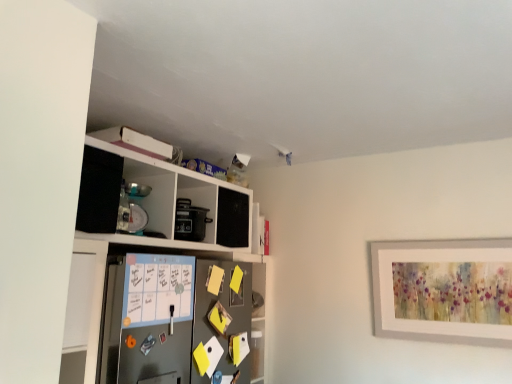
Where is `white matte cabinet at upper left`? The height and width of the screenshot is (384, 512). white matte cabinet at upper left is located at coordinates (162, 276).

The image size is (512, 384). What do you see at coordinates (162, 276) in the screenshot?
I see `white matte cabinet at upper left` at bounding box center [162, 276].

You are a GUI agent. You are given a task and a screenshot of the screen. Output one action in this format:
    pyautogui.click(x=<x>, y=<y>)
    Task: Click on the metallic gray refrigerator at center
    
    Given the screenshot: What is the action you would take?
    pyautogui.click(x=165, y=316)

This screenshot has height=384, width=512. What do you see at coordinates (165, 316) in the screenshot?
I see `metallic gray refrigerator at center` at bounding box center [165, 316].

Identify the location of white matte cabinet at upper left. (162, 276).

Considering the relative positions of white matte cabinet at upper left and metallic gray refrigerator at center in the image provided, is white matte cabinet at upper left to the left of metallic gray refrigerator at center from the viewer's perspective?

Yes.

Which object is further away from the camera, white matte cabinet at upper left or metallic gray refrigerator at center?

metallic gray refrigerator at center is further away from the camera.

Which is in front, point (120, 239) or point (231, 302)?

The point (120, 239) is closer to the camera.

From the image's perspective, is white matte cabinet at upper left positioned above or below metallic gray refrigerator at center?

From the image's perspective, white matte cabinet at upper left appears above metallic gray refrigerator at center.

From a real-world perspective, is white matte cabinet at upper left physically above metallic gray refrigerator at center?

Correct, in the physical world, white matte cabinet at upper left is higher than metallic gray refrigerator at center.

Which object is wider, white matte cabinet at upper left or metallic gray refrigerator at center?

white matte cabinet at upper left.

Considering the sizes of objects white matte cabinet at upper left and metallic gray refrigerator at center in the image provided, who is shorter, white matte cabinet at upper left or metallic gray refrigerator at center?

With less height is metallic gray refrigerator at center.

In the scene shown: Between white matte cabinet at upper left and metallic gray refrigerator at center, which one has smaller size?

metallic gray refrigerator at center.

Is white matte cabinet at upper left completely or partially outside of metallic gray refrigerator at center?

Yes, white matte cabinet at upper left is located beyond the bounds of metallic gray refrigerator at center.

Are white matte cabinet at upper left and metallic gray refrigerator at center far apart?

They are positioned close to each other.

Consider the image. Is white matte cabinet at upper left oriented towards metallic gray refrigerator at center?

Yes, white matte cabinet at upper left is aimed at metallic gray refrigerator at center.

How many degrees apart are the facing directions of white matte cabinet at upper left and metallic gray refrigerator at center?

The facing directions of white matte cabinet at upper left and metallic gray refrigerator at center are 3.23e-05 degrees apart.

This screenshot has width=512, height=384. In order to click on shelf lying on the left of metallic gray refrigerator at center in this screenshot , I will do `click(162, 276)`.

Considering the positions of objects metallic gray refrigerator at center and white matte cabinet at upper left in the image provided, who is more to the right, metallic gray refrigerator at center or white matte cabinet at upper left?

metallic gray refrigerator at center.

In the image, is metallic gray refrigerator at center positioned in front of or behind white matte cabinet at upper left?

metallic gray refrigerator at center is behind white matte cabinet at upper left.

Between point (174, 295) and point (250, 288), which one is positioned behind?

The point (250, 288) is farther.

From the image's perspective, is metallic gray refrigerator at center on top of white matte cabinet at upper left?

No, from the image's perspective, metallic gray refrigerator at center is not over white matte cabinet at upper left.

From a real-world perspective, between metallic gray refrigerator at center and white matte cabinet at upper left, who is vertically lower?

In real-world perspective, metallic gray refrigerator at center is lower.

Which of these two, metallic gray refrigerator at center or white matte cabinet at upper left, is thinner?

With smaller width is metallic gray refrigerator at center.

From their relative heights in the image, would you say metallic gray refrigerator at center is taller or shorter than white matte cabinet at upper left?

In the image, metallic gray refrigerator at center appears to be shorter than white matte cabinet at upper left.

Is metallic gray refrigerator at center smaller than white matte cabinet at upper left?

Indeed, metallic gray refrigerator at center has a smaller size compared to white matte cabinet at upper left.

Is metallic gray refrigerator at center completely or partially outside of white matte cabinet at upper left?

No, metallic gray refrigerator at center is not entirely external to white matte cabinet at upper left.

Is metallic gray refrigerator at center beside white matte cabinet at upper left?

metallic gray refrigerator at center is not next to white matte cabinet at upper left, and they're not touching.

Is metallic gray refrigerator at center positioned with its back to white matte cabinet at upper left?

Yes, metallic gray refrigerator at center is facing away from white matte cabinet at upper left.

How many degrees apart are the facing directions of metallic gray refrigerator at center and white matte cabinet at upper left?

They differ by 3.23e-05 degrees in their facing directions.

Where is `shelf above the metallic gray refrigerator at center (from a real-world perspective)`? This screenshot has width=512, height=384. shelf above the metallic gray refrigerator at center (from a real-world perspective) is located at coordinates (162, 276).

Where is `shelf above the metallic gray refrigerator at center (from a real-world perspective)`? This screenshot has height=384, width=512. shelf above the metallic gray refrigerator at center (from a real-world perspective) is located at coordinates (162, 276).

The height and width of the screenshot is (384, 512). In the image, there is a metallic gray refrigerator at center. What are the coordinates of `shelf above it (from the image's perspective)` in the screenshot? It's located at (162, 276).